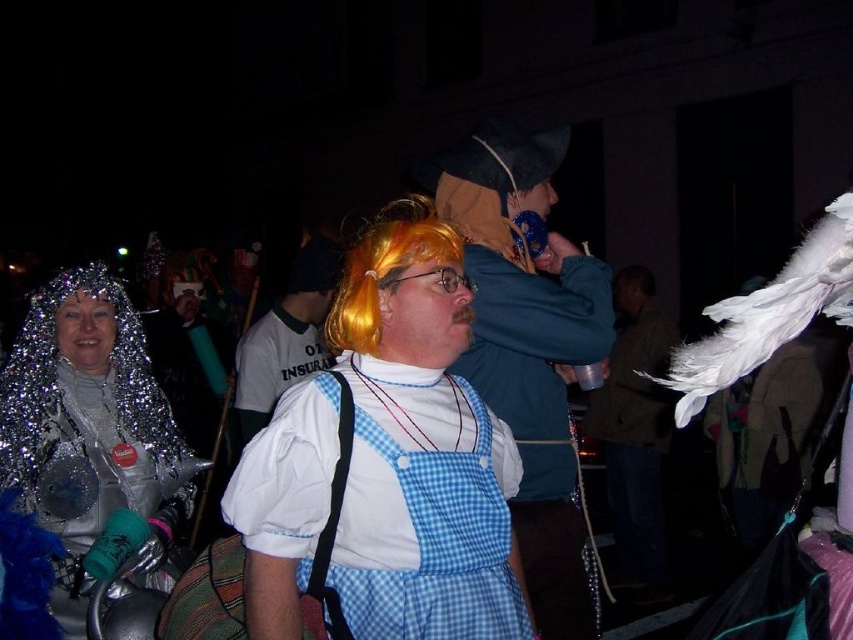
Question: Can you confirm if shiny metallic wig at center is thinner than orange wig at center?

Choices:
 (A) yes
 (B) no

Answer: (B)

Question: Which is nearer to the blue checkered overalls at center?

Choices:
 (A) orange wig at center
 (B) shiny metallic wig at center

Answer: (B)

Question: Is shiny metallic wig at center below blue checkered overalls at center?

Choices:
 (A) no
 (B) yes

Answer: (B)

Question: Which of the following is the farthest from the observer?

Choices:
 (A) (490, 554)
 (B) (639, 307)
 (C) (350, 323)

Answer: (B)

Question: Is sparkly silver headpiece at upper left positioned behind white feather boa at right?

Choices:
 (A) yes
 (B) no

Answer: (B)

Question: Considering the real-world distances, which object is closest to the orange synthetic wig at center?

Choices:
 (A) white feather boa at right
 (B) sparkly silver headpiece at upper left
 (C) orange wig at center

Answer: (B)